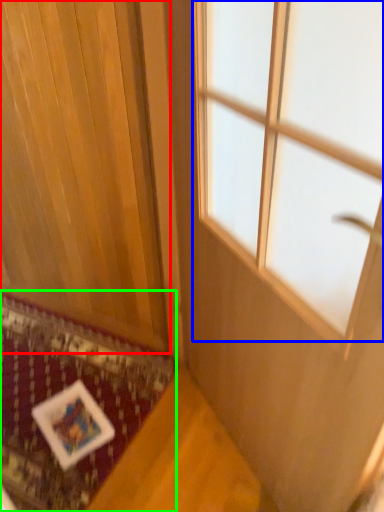
Question: Estimate the real-world distances between objects in this image. Which object is farther from curtain (highlighted by a red box), window (highlighted by a blue box) or mat (highlighted by a green box)?

Choices:
 (A) window
 (B) mat

Answer: (A)